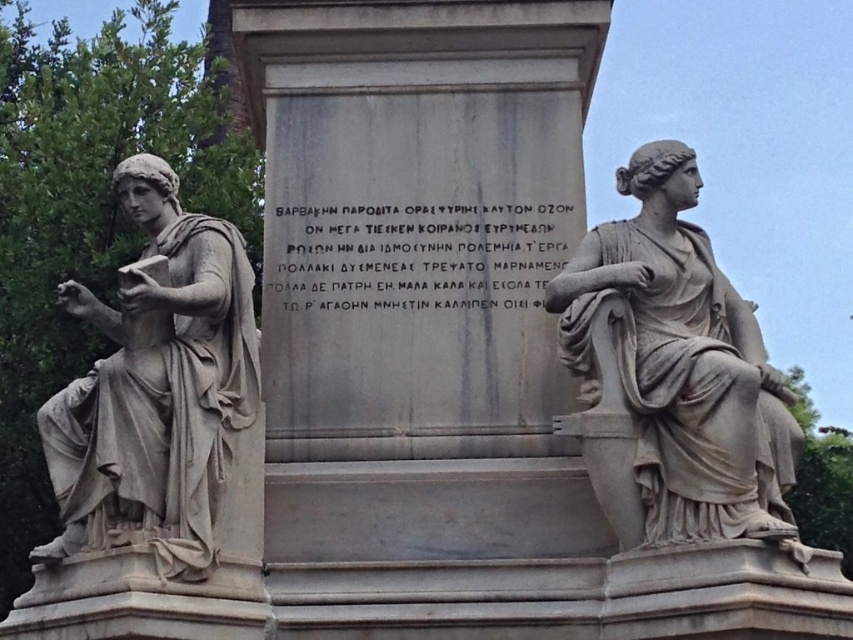
Question: Does matte gray statue at right appear over matte gray statue at left?

Choices:
 (A) no
 (B) yes

Answer: (B)

Question: Which object is farther from the camera taking this photo?

Choices:
 (A) matte gray statue at right
 (B) matte gray statue at left

Answer: (B)

Question: Does matte gray statue at right have a smaller size compared to matte gray statue at left?

Choices:
 (A) yes
 (B) no

Answer: (B)

Question: Can you confirm if matte gray statue at right is wider than matte gray statue at left?

Choices:
 (A) yes
 (B) no

Answer: (A)